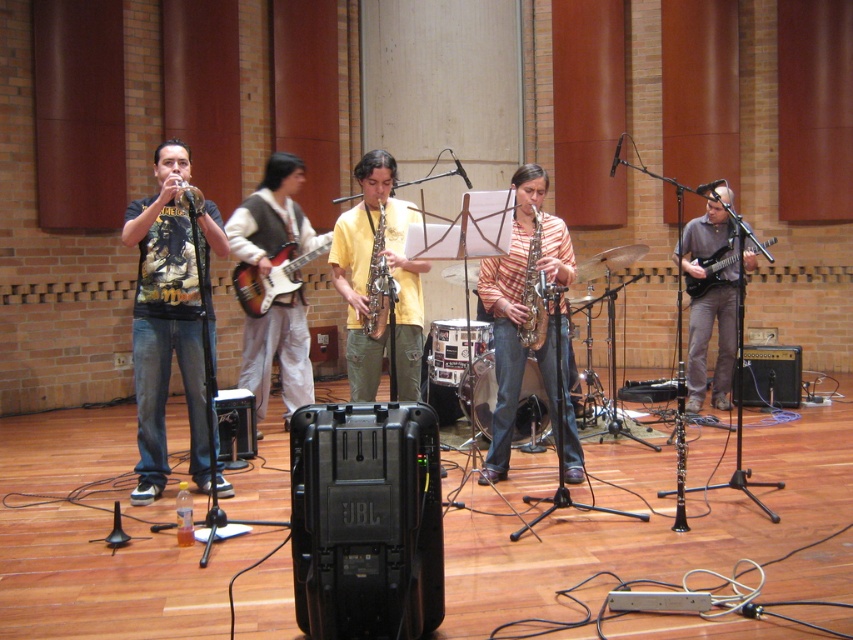
Question: Does striped fabric saxophone at center have a larger size compared to matte electric guitar at center?

Choices:
 (A) yes
 (B) no

Answer: (A)

Question: Which point is farther to the camera?

Choices:
 (A) striped fabric saxophone at center
 (B) yellow matte saxophone at center

Answer: (B)

Question: From the image, what is the correct spatial relationship of light brown fabric vest at center in relation to matte electric guitar at center?

Choices:
 (A) left
 (B) right

Answer: (B)

Question: Considering the relative positions of light brown fabric vest at center and gold metallic saxophone at center in the image provided, where is light brown fabric vest at center located with respect to gold metallic saxophone at center?

Choices:
 (A) above
 (B) below

Answer: (B)

Question: Which of these objects is positioned farthest from the matte black trumpet at left?

Choices:
 (A) metallic silver drum at center
 (B) light brown fabric vest at center

Answer: (A)

Question: Which is farther from the metallic electric guitar at right?

Choices:
 (A) brushed metal trumpet at left
 (B) light brown fabric vest at center
 (C) gold metallic saxophone at center

Answer: (A)